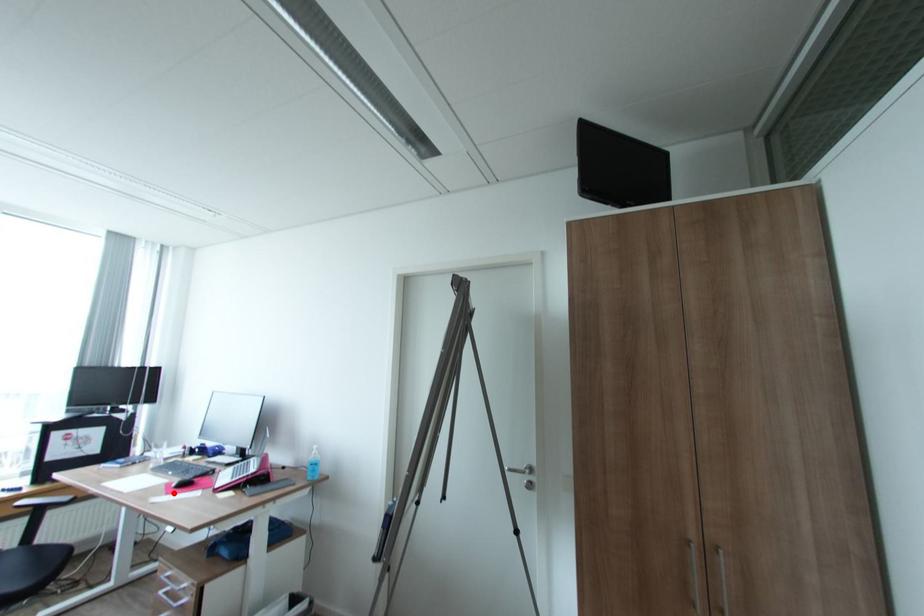
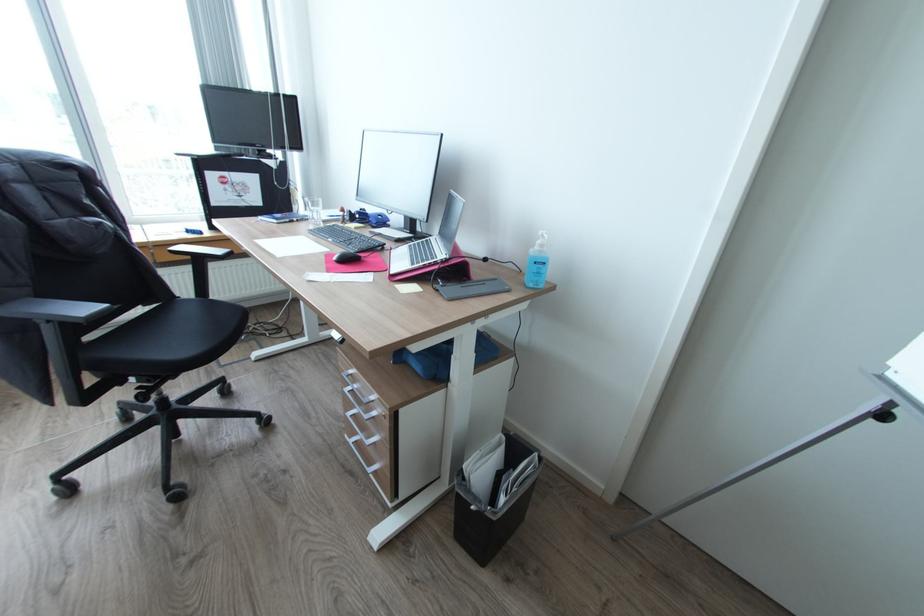
Locate, in the second image, the point that corresponds to the highlighted location in the first image.

(334, 270)